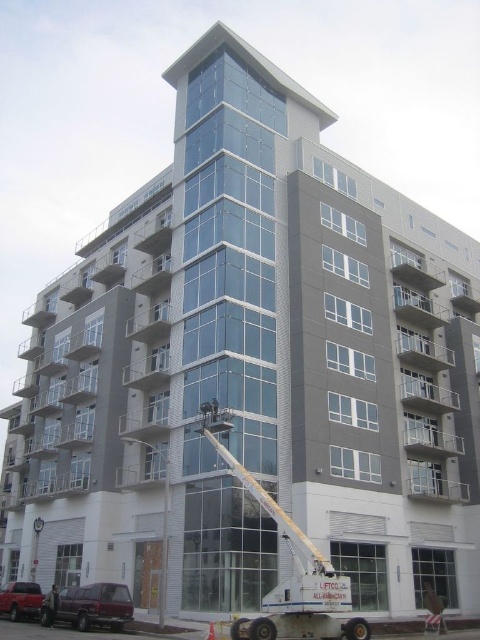
Can you confirm if maroon metallic van at lower left is positioned to the right of dark gray uniform at lower left?

Yes, maroon metallic van at lower left is to the right of dark gray uniform at lower left.

Does maroon metallic van at lower left have a larger size compared to dark gray uniform at lower left?

Correct, maroon metallic van at lower left is larger in size than dark gray uniform at lower left.

What do you see at coordinates (95, 605) in the screenshot? The height and width of the screenshot is (640, 480). I see `maroon metallic van at lower left` at bounding box center [95, 605].

Locate an element on the screen. Image resolution: width=480 pixels, height=640 pixels. maroon metallic van at lower left is located at coordinates (95, 605).

Does point (0, 608) come behind point (48, 624)?

That is True.

Is point (26, 604) more distant than point (50, 602)?

Yes.

Locate an element on the screen. The image size is (480, 640). metallic red van at lower left is located at coordinates (21, 600).

Who is lower down, maroon metallic van at lower left or metallic red van at lower left?

Positioned lower is metallic red van at lower left.

Who is higher up, maroon metallic van at lower left or metallic red van at lower left?

maroon metallic van at lower left

You are a GUI agent. You are given a task and a screenshot of the screen. Output one action in this format:
    pyautogui.click(x=<x>, y=<y>)
    Task: Click on the maroon metallic van at lower left
    
    Given the screenshot: What is the action you would take?
    pyautogui.click(x=95, y=605)